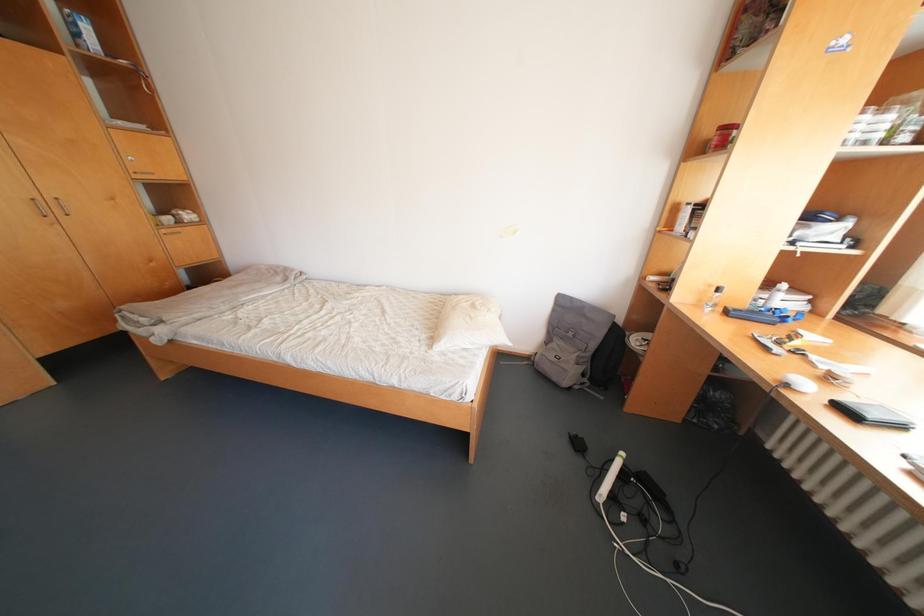
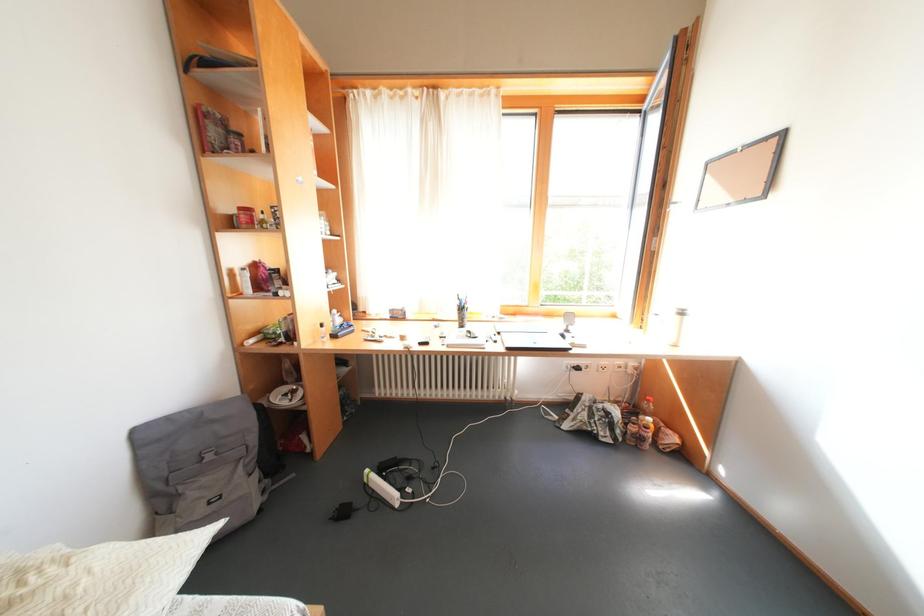
The first image is from the beginning of the video and the second image is from the end. How did the camera likely rotate when shooting the video?

The camera's rotation is toward right-down.